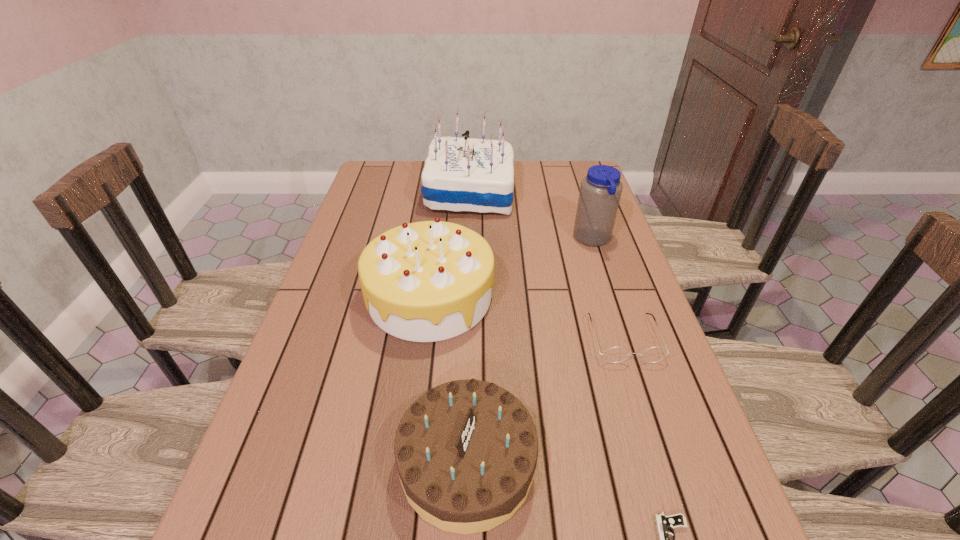
Identify the location of the tallest birthday cake. This screenshot has height=540, width=960. (460, 174).

The width and height of the screenshot is (960, 540). What are the coordinates of `the farthest birthday cake` in the screenshot? It's located at (460, 174).

The height and width of the screenshot is (540, 960). I want to click on water bottle, so click(x=600, y=191).

The width and height of the screenshot is (960, 540). I want to click on the second tallest birthday cake, so (x=427, y=281).

You are a GUI agent. You are given a task and a screenshot of the screen. Output one action in this format:
    pyautogui.click(x=<x>, y=<y>)
    Task: Click on the third shortest object
    The width and height of the screenshot is (960, 540).
    Given the screenshot: What is the action you would take?
    pyautogui.click(x=466, y=451)

What are the coordinates of `the shortest birthday cake` in the screenshot? It's located at (466, 451).

What are the coordinates of `spectacles` in the screenshot? It's located at (615, 354).

Locate an element on the screen. The image size is (960, 540). blank area located on the front of the farthest birthday cake is located at coordinates (468, 228).

This screenshot has height=540, width=960. I want to click on vacant region located 0.160m with a carrying loop on the side of the second farthest object, so click(x=521, y=240).

Image resolution: width=960 pixels, height=540 pixels. I want to click on vacant space located 0.290m with a carrying loop on the side of the second farthest object, so click(478, 240).